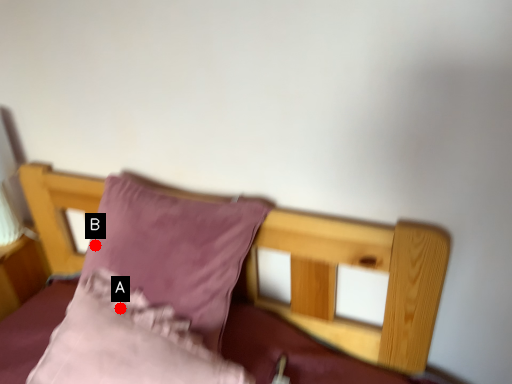
Question: Two points are circled on the image, labeled by A and B beside each circle. Which point is further to the camera?

Choices:
 (A) A is further
 (B) B is further

Answer: (B)